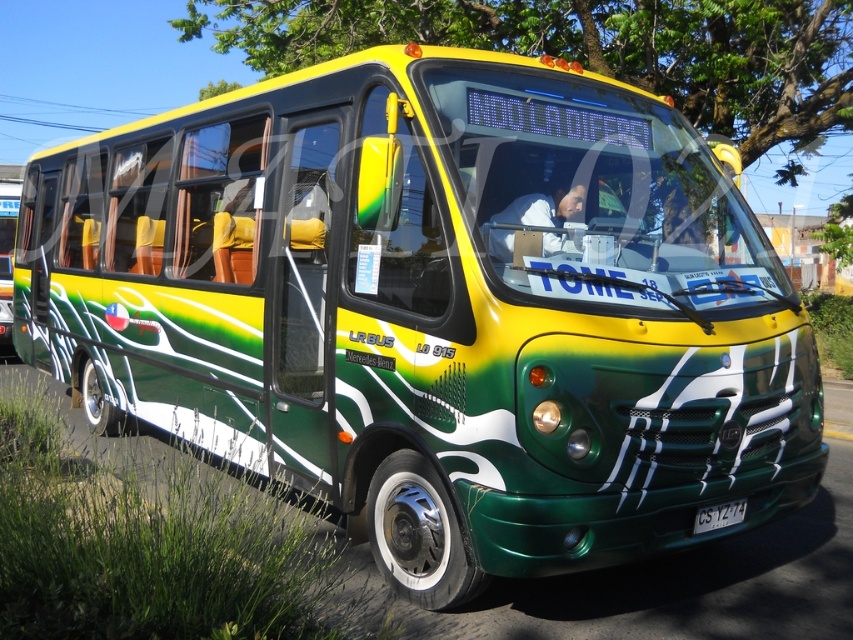
Who is shorter, white fabric at center or white plastic license plate at center?

Standing shorter between the two is white plastic license plate at center.

Is white fabric at center to the left of white plastic license plate at center from the viewer's perspective?

Indeed, white fabric at center is positioned on the left side of white plastic license plate at center.

In the scene shown: Who is more distant from viewer, (x=538, y=193) or (x=726, y=509)?

Point (x=726, y=509)

Identify the location of white fabric at center. The height and width of the screenshot is (640, 853). (544, 208).